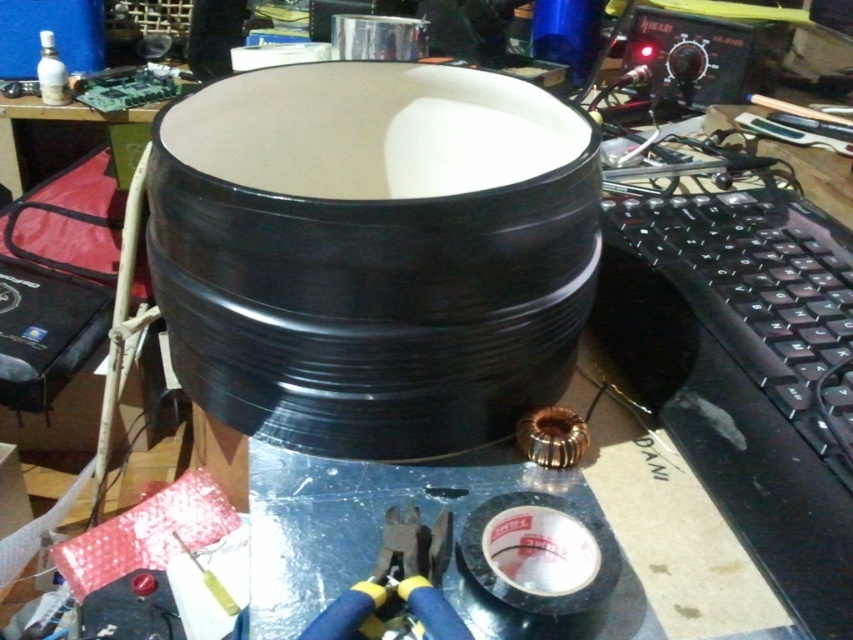
Question: Can you confirm if black glossy drum at center is positioned to the right of blue/yellow plastic pliers at lower center?

Choices:
 (A) yes
 (B) no

Answer: (B)

Question: Can you confirm if black glossy drum at center is positioned to the left of blue/yellow plastic pliers at lower center?

Choices:
 (A) no
 (B) yes

Answer: (B)

Question: Can you confirm if black glossy drum at center is wider than blue/yellow plastic pliers at lower center?

Choices:
 (A) yes
 (B) no

Answer: (A)